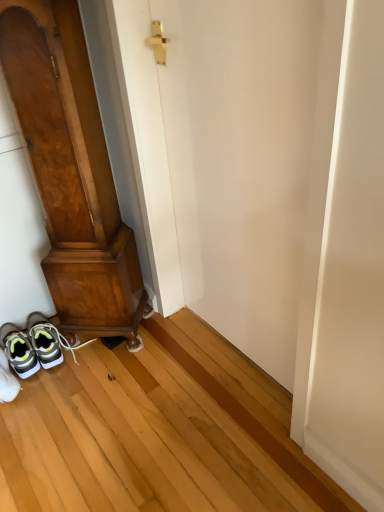
I want to click on vacant area that lies between white smooth door at center, which ranks as the 2th door in left-to-right order, and wooden door at left, the first door from the left, so click(x=163, y=362).